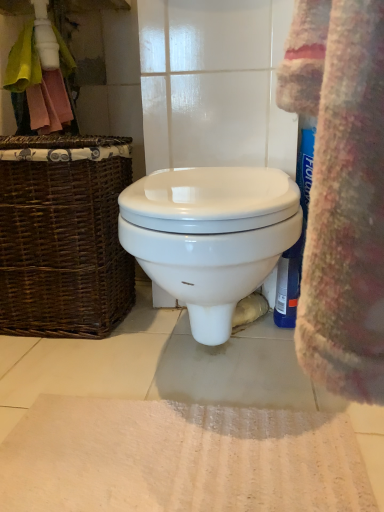
Question: Should I look upward or downward to see white textured bath mat at lower center?

Choices:
 (A) down
 (B) up

Answer: (A)

Question: Could you tell me if white glossy toilet at center is turned towards brown wicker picnic basket at left?

Choices:
 (A) yes
 (B) no

Answer: (B)

Question: Is white glossy toilet at center further to camera compared to brown wicker picnic basket at left?

Choices:
 (A) yes
 (B) no

Answer: (B)

Question: Is brown wicker picnic basket at left located within white glossy toilet at center?

Choices:
 (A) yes
 (B) no

Answer: (B)

Question: Is white glossy toilet at center wider than brown wicker picnic basket at left?

Choices:
 (A) no
 (B) yes

Answer: (B)

Question: From the image's perspective, is white glossy toilet at center beneath brown wicker picnic basket at left?

Choices:
 (A) no
 (B) yes

Answer: (B)

Question: Is white glossy toilet at center next to brown wicker picnic basket at left and touching it?

Choices:
 (A) yes
 (B) no

Answer: (B)

Question: Does brown wicker picnic basket at left come in front of white textured bath mat at lower center?

Choices:
 (A) no
 (B) yes

Answer: (A)

Question: Does brown wicker picnic basket at left have a lesser height compared to white textured bath mat at lower center?

Choices:
 (A) yes
 (B) no

Answer: (B)

Question: From a real-world perspective, does brown wicker picnic basket at left sit lower than white textured bath mat at lower center?

Choices:
 (A) no
 (B) yes

Answer: (A)

Question: From the image's perspective, is brown wicker picnic basket at left located above white textured bath mat at lower center?

Choices:
 (A) no
 (B) yes

Answer: (B)

Question: Is brown wicker picnic basket at left taller than white textured bath mat at lower center?

Choices:
 (A) yes
 (B) no

Answer: (A)

Question: Is brown wicker picnic basket at left not inside white textured bath mat at lower center?

Choices:
 (A) no
 (B) yes

Answer: (B)

Question: Is brown wicker picnic basket at left oriented towards white glossy toilet at center?

Choices:
 (A) yes
 (B) no

Answer: (B)